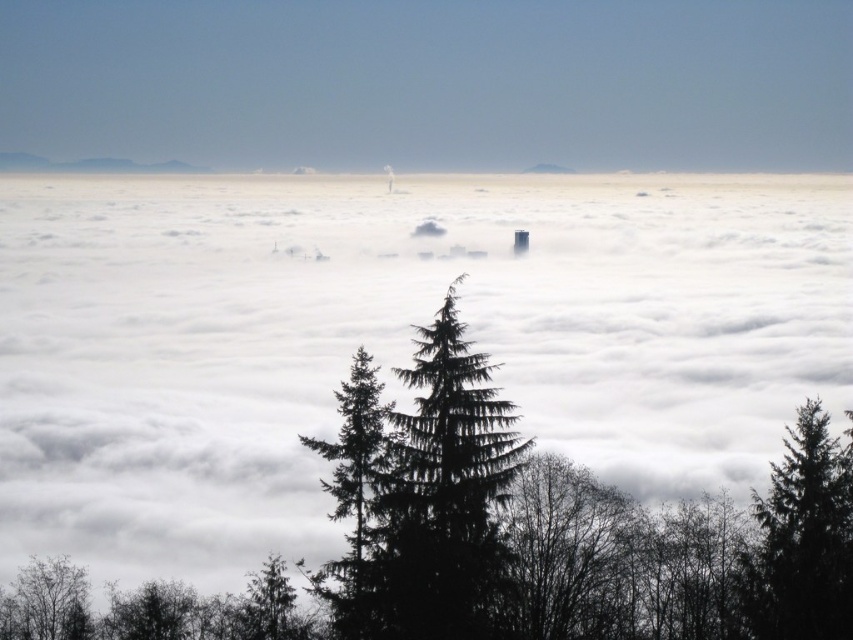
Question: Can you confirm if green matte tree at lower right is bigger than silhouette leafy tree at lower left?

Choices:
 (A) yes
 (B) no

Answer: (B)

Question: Observing the image, what is the correct spatial positioning of white fluffy cloud at center in reference to silhouette leafy tree at lower left?

Choices:
 (A) right
 (B) left

Answer: (A)

Question: In this image, where is white fluffy cloud at center located relative to green textured pine tree at center?

Choices:
 (A) above
 (B) below

Answer: (A)

Question: Which point is farther to the camera?

Choices:
 (A) silhouette leafy tree at lower left
 (B) gray foggy peak at center
 (C) green matte tree at lower right

Answer: (B)

Question: Which object is closer to the camera taking this photo?

Choices:
 (A) gray foggy peak at center
 (B) green matte tree at lower right

Answer: (B)

Question: Which object is closer to the camera taking this photo?

Choices:
 (A) gray foggy peak at center
 (B) green matte tree at lower right
 (C) green textured pine tree at center
 (D) white fluffy cloud at center

Answer: (C)